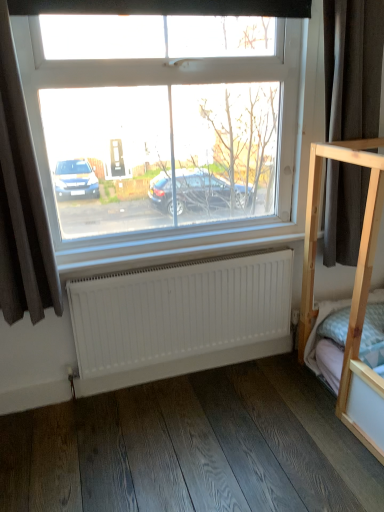
The image size is (384, 512). In order to click on free spot above dark wood flooring at lower center (from a real-world perspective) in this screenshot , I will do [x=192, y=434].